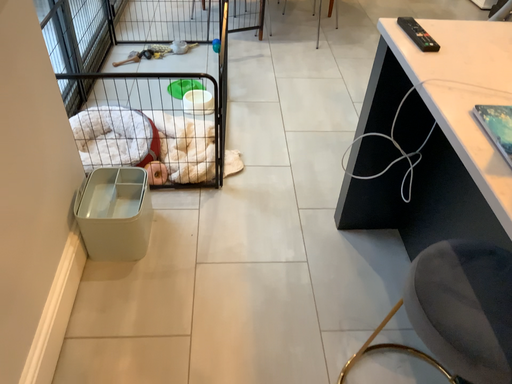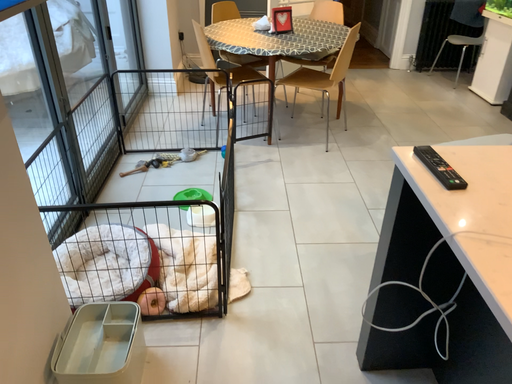
Question: How did the camera likely rotate when shooting the video?

Choices:
 (A) rotated downward
 (B) rotated upward

Answer: (B)